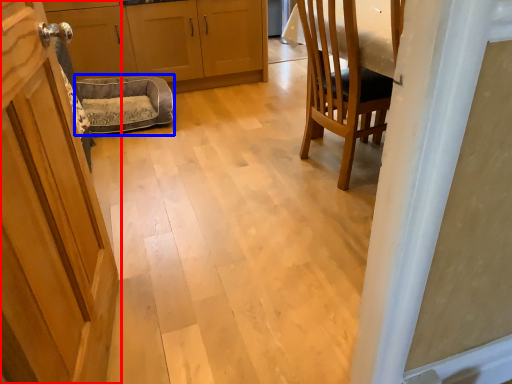
Question: Which point is further to the camera, door (highlighted by a red box) or dog bed (highlighted by a blue box)?

Choices:
 (A) door
 (B) dog bed

Answer: (B)